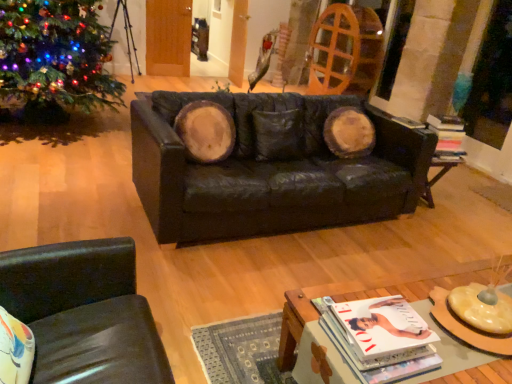
Question: Can you see black leather couch at center touching green matte christmas tree at left?

Choices:
 (A) no
 (B) yes

Answer: (A)

Question: From the image's perspective, is black leather couch at center under green matte christmas tree at left?

Choices:
 (A) yes
 (B) no

Answer: (A)

Question: Is green matte christmas tree at left at the back of black leather couch at center?

Choices:
 (A) yes
 (B) no

Answer: (A)

Question: Does black leather couch at center have a smaller size compared to green matte christmas tree at left?

Choices:
 (A) no
 (B) yes

Answer: (B)

Question: Does black leather couch at center have a lesser width compared to green matte christmas tree at left?

Choices:
 (A) yes
 (B) no

Answer: (A)

Question: From a real-world perspective, relative to green matte christmas tree at left, is matte white magazine at lower center, arranged as the first magazine when ordered from the bottom, vertically above or below?

Choices:
 (A) below
 (B) above

Answer: (A)

Question: Is point (394, 327) closer or farther from the camera than point (90, 94)?

Choices:
 (A) farther
 (B) closer

Answer: (B)

Question: Is matte white magazine at lower center, placed as the 2th magazine when sorted from top to bottom, bigger or smaller than green matte christmas tree at left?

Choices:
 (A) big
 (B) small

Answer: (B)

Question: From the image's perspective, is matte white magazine at lower center, placed as the 1th magazine when sorted from left to right, located above or below green matte christmas tree at left?

Choices:
 (A) above
 (B) below

Answer: (B)

Question: From a real-world perspective, is matte white magazine at lower center, marked as the first magazine in a front-to-back arrangement, physically located above or below matte black magazine at right, which appears as the first magazine when viewed from the right?

Choices:
 (A) above
 (B) below

Answer: (B)

Question: Is matte white magazine at lower center, the second magazine positioned from the right, taller or shorter than matte black magazine at right, the first magazine positioned from the top?

Choices:
 (A) tall
 (B) short

Answer: (B)

Question: Is point (368, 349) closer or farther from the camera than point (449, 155)?

Choices:
 (A) farther
 (B) closer

Answer: (B)

Question: Choose the correct answer: Is matte white magazine at lower center, placed as the 2th magazine when sorted from top to bottom, inside matte black magazine at right, acting as the 2th magazine starting from the front, or outside it?

Choices:
 (A) outside
 (B) inside

Answer: (A)

Question: Does point (429, 195) appear closer or farther from the camera than point (309, 324)?

Choices:
 (A) closer
 (B) farther

Answer: (B)

Question: From a real-world perspective, is black leather side table at lower right physically located above or below wooden coffee table at lower center?

Choices:
 (A) above
 (B) below

Answer: (A)